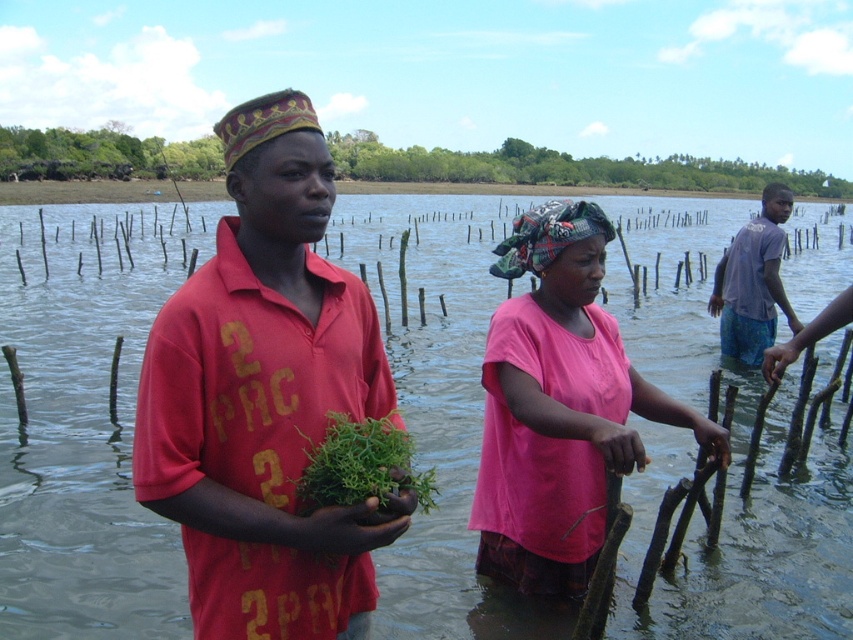
Question: Which object appears closest to the camera in this image?

Choices:
 (A) pink fabric headscarf at center
 (B) clear water at center
 (C) green leafy plant at center

Answer: (C)

Question: From the image, what is the correct spatial relationship of clear water at center in relation to light blue fabric shorts at right?

Choices:
 (A) left
 (B) right

Answer: (B)

Question: Which object appears closest to the camera in this image?

Choices:
 (A) clear water at center
 (B) matte red shirt at center
 (C) light blue fabric shorts at right

Answer: (B)

Question: Based on their relative distances, which object is nearer to the light blue fabric shorts at right?

Choices:
 (A) matte red shirt at center
 (B) clear water at center
 (C) pink fabric headscarf at center
 (D) green leafy plant at center

Answer: (C)

Question: Observing the image, what is the correct spatial positioning of pink fabric headscarf at center in reference to green leafy plant at center?

Choices:
 (A) below
 (B) above

Answer: (B)

Question: Can you confirm if clear water at center is positioned to the right of pink fabric headscarf at center?

Choices:
 (A) no
 (B) yes

Answer: (B)